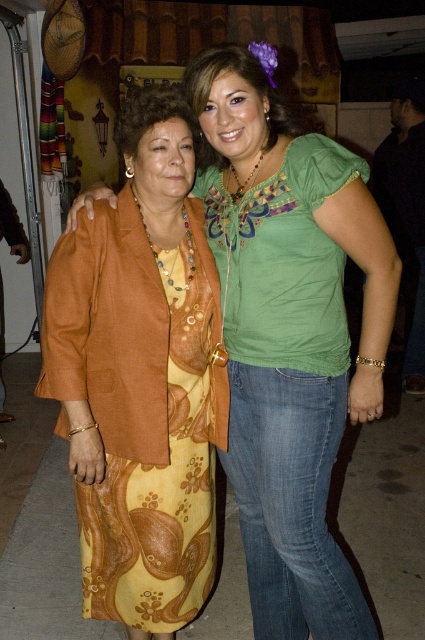
Question: Where is matte orange dress at center located in relation to yellow floral dress at center in the image?

Choices:
 (A) right
 (B) left

Answer: (A)

Question: Can you confirm if matte orange dress at center is positioned to the right of yellow floral dress at center?

Choices:
 (A) no
 (B) yes

Answer: (B)

Question: Which of the following is the farthest from the observer?

Choices:
 (A) yellow floral dress at center
 (B) matte orange dress at center

Answer: (A)

Question: Which of the following is the farthest from the observer?

Choices:
 (A) matte orange dress at center
 (B) yellow floral dress at center

Answer: (B)

Question: Is matte orange dress at center positioned at the back of yellow floral dress at center?

Choices:
 (A) no
 (B) yes

Answer: (A)